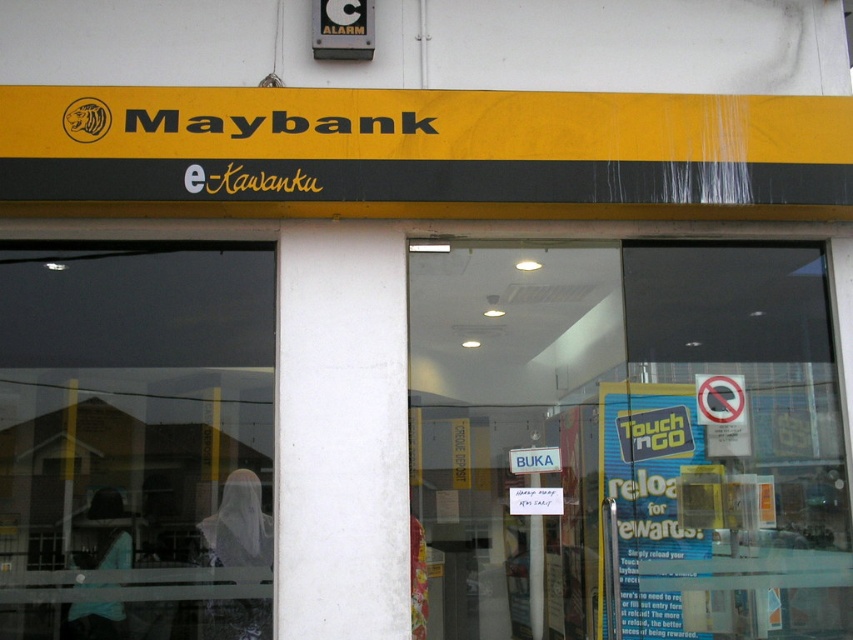
You are standing outside the Maybank branch and want to enter through the entrance. You notice two transparent glass sections. The transparent glass door at center and the transparent glass at left. Which one is wider?

The transparent glass door at center is wider than the transparent glass at left.